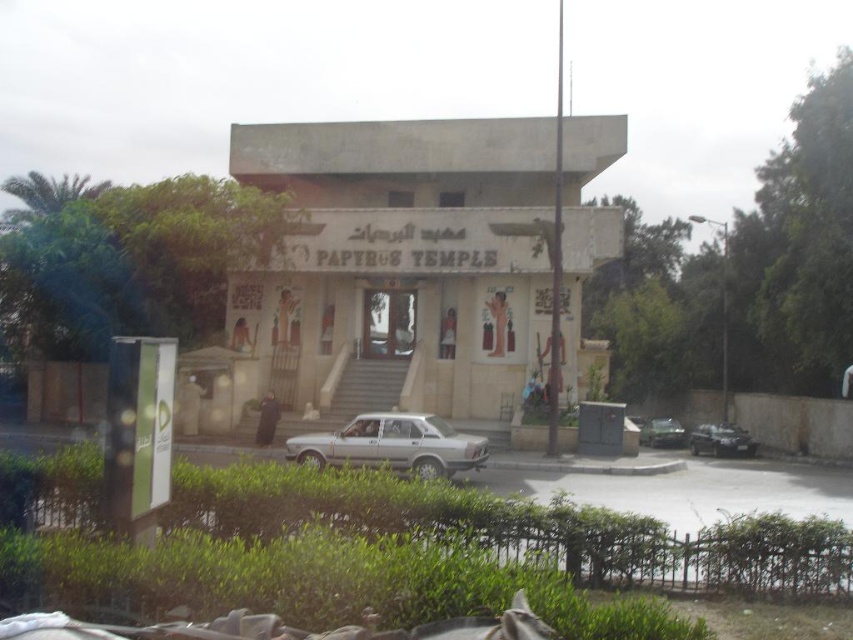
Between silver metallic sedan at center and silver metallic car at center, which one has more height?

silver metallic car at center

Looking at this image, between silver metallic sedan at center and silver metallic car at center, which one appears on the left side from the viewer's perspective?

From the viewer's perspective, silver metallic sedan at center appears more on the left side.

Between point (433, 451) and point (642, 433), which one is positioned behind?

Point (642, 433)

The height and width of the screenshot is (640, 853). I want to click on silver metallic sedan at center, so click(392, 444).

Can you confirm if silver metallic sedan at center is positioned to the right of satin silver sedan at center?

In fact, silver metallic sedan at center is to the left of satin silver sedan at center.

What are the coordinates of `silver metallic sedan at center` in the screenshot? It's located at (392, 444).

The height and width of the screenshot is (640, 853). What are the coordinates of `silver metallic sedan at center` in the screenshot? It's located at (392, 444).

The width and height of the screenshot is (853, 640). Find the location of `green leafy shrubs at lower center`. green leafy shrubs at lower center is located at coordinates (432, 544).

Does green leafy shrubs at lower center have a lesser width compared to silver metallic car at center?

Incorrect, green leafy shrubs at lower center's width is not less than silver metallic car at center's.

Find the location of a particular element. green leafy shrubs at lower center is located at coordinates (432, 544).

Identify the location of green leafy shrubs at lower center. (432, 544).